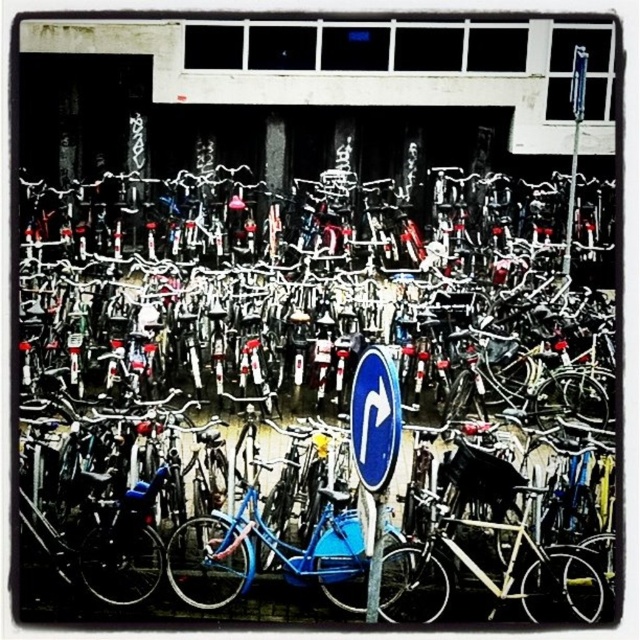
The height and width of the screenshot is (640, 640). What do you see at coordinates (307, 381) in the screenshot? I see `blue matte bicycle at center` at bounding box center [307, 381].

Is blue matte bicycle at center positioned in front of blue plastic street sign at center?

No, blue matte bicycle at center is behind blue plastic street sign at center.

Is point (404, 580) positioned after point (362, 376)?

That is True.

Locate an element on the screen. The image size is (640, 640). blue matte bicycle at center is located at coordinates (307, 381).